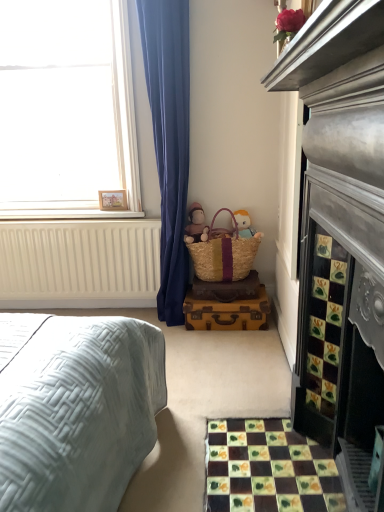
Question: Can you confirm if beige wicker basket at center is taller than multicolored mosaic tiles at lower right?

Choices:
 (A) no
 (B) yes

Answer: (B)

Question: Does beige wicker basket at center touch multicolored mosaic tiles at lower right?

Choices:
 (A) yes
 (B) no

Answer: (B)

Question: Can multicolored mosaic tiles at lower right be found inside beige wicker basket at center?

Choices:
 (A) yes
 (B) no

Answer: (B)

Question: From a real-world perspective, is beige wicker basket at center physically below multicolored mosaic tiles at lower right?

Choices:
 (A) yes
 (B) no

Answer: (B)

Question: Is beige wicker basket at center at the left side of multicolored mosaic tiles at lower right?

Choices:
 (A) no
 (B) yes

Answer: (A)

Question: From their relative heights in the image, would you say white matte window at upper left is taller or shorter than beige wicker basket at center?

Choices:
 (A) short
 (B) tall

Answer: (B)

Question: In terms of width, does white matte window at upper left look wider or thinner when compared to beige wicker basket at center?

Choices:
 (A) thin
 (B) wide

Answer: (B)

Question: Based on their positions, is white matte window at upper left located to the left or right of beige wicker basket at center?

Choices:
 (A) left
 (B) right

Answer: (A)

Question: In terms of size, does white matte window at upper left appear bigger or smaller than beige wicker basket at center?

Choices:
 (A) small
 (B) big

Answer: (B)

Question: Do you think white painted wood at upper left is within woven straw picnic basket at lower center, or outside of it?

Choices:
 (A) inside
 (B) outside

Answer: (B)

Question: From the image's perspective, is white painted wood at upper left positioned above or below woven straw picnic basket at lower center?

Choices:
 (A) below
 (B) above

Answer: (B)

Question: Based on their sizes in the image, would you say white painted wood at upper left is bigger or smaller than woven straw picnic basket at lower center?

Choices:
 (A) big
 (B) small

Answer: (B)

Question: Does point click(28, 209) appear closer or farther from the camera than point click(235, 264)?

Choices:
 (A) closer
 (B) farther

Answer: (B)

Question: Based on their positions, is woven straw picnic basket at lower center located to the left or right of white painted wood at upper left?

Choices:
 (A) right
 (B) left

Answer: (A)

Question: In the image, is woven straw picnic basket at lower center positioned in front of or behind white painted wood at upper left?

Choices:
 (A) behind
 (B) front

Answer: (B)